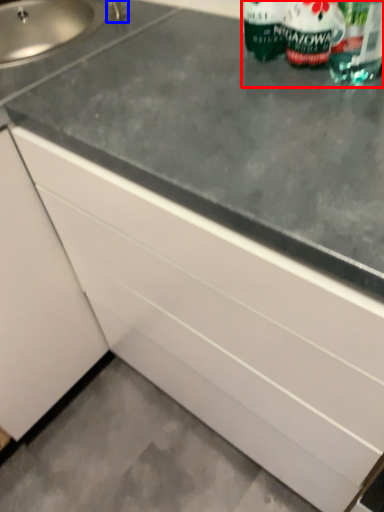
Question: Which object appears closest to the camera in this image, bottle (highlighted by a red box) or faucet (highlighted by a blue box)?

Choices:
 (A) bottle
 (B) faucet

Answer: (A)